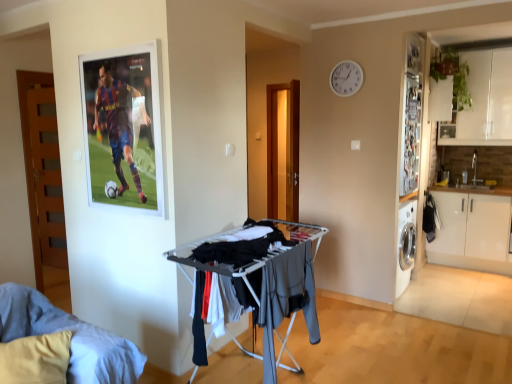
This screenshot has height=384, width=512. In order to click on dark gray fabric drying rack at center in this screenshot , I will do coord(242,245).

Image resolution: width=512 pixels, height=384 pixels. What do you see at coordinates (72, 337) in the screenshot?
I see `light blue fabric bed at lower left` at bounding box center [72, 337].

Locate an element on the screen. The height and width of the screenshot is (384, 512). dark gray fabric drying rack at center is located at coordinates (242, 245).

You are a GUI agent. You are given a task and a screenshot of the screen. Output one action in this format:
    pyautogui.click(x=<x>, y=<y>)
    Task: Click on the laundry on the left side of white matte cabinet at right
    The height and width of the screenshot is (384, 512).
    Given the screenshot: What is the action you would take?
    pyautogui.click(x=242, y=245)

Between dark gray fabric drying rack at center and white matte cabinet at right, which one is positioned behind?

white matte cabinet at right is further from the camera.

Who is bigger, dark gray fabric drying rack at center or white matte cabinet at right?

white matte cabinet at right.

Can you confirm if dark gray fabric drying rack at center is thinner than white matte cabinet at right?

Indeed, dark gray fabric drying rack at center has a lesser width compared to white matte cabinet at right.

From a real-world perspective, who is located lower, white matte cabinet at right or wooden door at left?

white matte cabinet at right.

Can you confirm if white matte cabinet at right is taller than wooden door at left?

No, white matte cabinet at right is not taller than wooden door at left.

Considering the positions of objects white matte cabinet at right and wooden door at left in the image provided, who is more to the right, white matte cabinet at right or wooden door at left?

white matte cabinet at right is more to the right.

Which is farther, (426, 249) or (52, 172)?

The point (426, 249) is more distant.

Is point (90, 377) positioned in front of point (353, 72)?

Yes, it is in front of point (353, 72).

Which of these two, light blue fabric bed at lower left or white plastic clock at upper center, stands shorter?

With less height is white plastic clock at upper center.

From the image's perspective, does light blue fabric bed at lower left appear lower than white plastic clock at upper center?

Yes.

Would you say light blue fabric bed at lower left is a long distance from white plastic clock at upper center?

Yes, light blue fabric bed at lower left and white plastic clock at upper center are quite far apart.

Considering the relative sizes of white matte cabinet at right and white plastic clock at upper center in the image provided, is white matte cabinet at right taller than white plastic clock at upper center?

Indeed, white matte cabinet at right has a greater height compared to white plastic clock at upper center.

Which is correct: white matte cabinet at right is inside white plastic clock at upper center, or outside of it?

white matte cabinet at right is located beyond the bounds of white plastic clock at upper center.

Does white matte cabinet at right turn towards white plastic clock at upper center?

No, white matte cabinet at right is not oriented towards white plastic clock at upper center.

From a real-world perspective, which object stands above the other?

In real-world perspective, white plastic clock at upper center is above.

Which of these two, wooden door at left or white plastic clock at upper center, is bigger?

Bigger between the two is wooden door at left.

From a real-world perspective, between wooden door at left and white plastic clock at upper center, who is vertically lower?

From a 3D spatial view, wooden door at left is below.

Would you consider wooden door at left to be distant from white plastic clock at upper center?

wooden door at left is far away from white plastic clock at upper center.

Does white plastic clock at upper center appear on the right side of white matte cabinet at right?

No, white plastic clock at upper center is not to the right of white matte cabinet at right.

Does white plastic clock at upper center have a greater width compared to white matte cabinet at right?

Incorrect, the width of white plastic clock at upper center does not surpass that of white matte cabinet at right.

Is white plastic clock at upper center positioned with its back to white matte cabinet at right?

No, white plastic clock at upper center is not facing away from white matte cabinet at right.

Who is shorter, white plastic clock at upper center or white matte cabinet at right?

Standing shorter between the two is white plastic clock at upper center.

Is white matte cabinet at right outside of dark gray fabric drying rack at center?

That's correct, white matte cabinet at right is outside of dark gray fabric drying rack at center.

Is white matte cabinet at right closer to the viewer compared to dark gray fabric drying rack at center?

No, white matte cabinet at right is behind dark gray fabric drying rack at center.

From the image's perspective, is white matte cabinet at right above dark gray fabric drying rack at center?

Actually, white matte cabinet at right appears below dark gray fabric drying rack at center in the image.

From a real-world perspective, is white matte cabinet at right on dark gray fabric drying rack at center?

Actually, white matte cabinet at right is physically below dark gray fabric drying rack at center in the real world.

The image size is (512, 384). What are the coordinates of `cabinetry below the dark gray fabric drying rack at center (from a real-world perspective)` in the screenshot? It's located at 473,229.

You are a GUI agent. You are given a task and a screenshot of the screen. Output one action in this format:
    pyautogui.click(x=<x>, y=<y>)
    Task: Click on the cabinetry behind the wooden door at left
    
    Given the screenshot: What is the action you would take?
    pyautogui.click(x=473, y=229)

When comparing their distances from light blue fabric bed at lower left, does dark gray fabric drying rack at center or white matte cabinet at right seem further?

Among the two, white matte cabinet at right is located further to light blue fabric bed at lower left.

Looking at the image, which one is located further to white plastic clock at upper center, wooden door at left or light blue fabric bed at lower left?

light blue fabric bed at lower left is further to white plastic clock at upper center.

Consider the image. When comparing their distances from dark gray fabric drying rack at center, does light blue fabric bed at lower left or wooden door at left seem closer?

light blue fabric bed at lower left.

Looking at the image, which one is located further to wooden door at left, white plastic clock at upper center or white matte cabinet at right?

Among the two, white matte cabinet at right is located further to wooden door at left.

Which object lies further to the anchor point white plastic clock at upper center, light blue fabric bed at lower left or white matte cabinet at right?

Based on the image, light blue fabric bed at lower left appears to be further to white plastic clock at upper center.

Looking at the image, which one is located closer to wooden door at left, white matte cabinet at right or light blue fabric bed at lower left?

light blue fabric bed at lower left is positioned closer to the anchor wooden door at left.

Which object lies further to the anchor point white matte cabinet at right, white plastic clock at upper center or dark gray fabric drying rack at center?

dark gray fabric drying rack at center is further to white matte cabinet at right.

When comparing their distances from wooden door at left, does white plastic clock at upper center or dark gray fabric drying rack at center seem closer?

dark gray fabric drying rack at center is closer to wooden door at left.

I want to click on laundry positioned between light blue fabric bed at lower left and wooden door at left from near to far, so click(x=242, y=245).

Locate an element on the screen. The image size is (512, 384). furniture located between wooden door at left and white plastic clock at upper center in the left-right direction is located at coordinates (72, 337).

Where is `laundry between light blue fabric bed at lower left and white plastic clock at upper center in the front-back direction`? laundry between light blue fabric bed at lower left and white plastic clock at upper center in the front-back direction is located at coordinates (242, 245).

This screenshot has height=384, width=512. What are the coordinates of `laundry between wooden door at left and white plastic clock at upper center in the horizontal direction` in the screenshot? It's located at (242, 245).